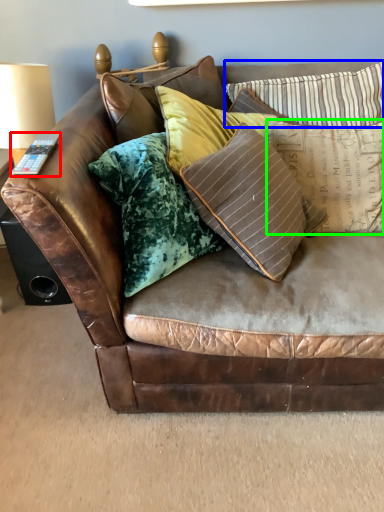
Question: Based on their relative distances, which object is nearer to remote (highlighted by a red box)? Choose from pillow (highlighted by a blue box) and pillow (highlighted by a green box).

Choices:
 (A) pillow
 (B) pillow

Answer: (B)